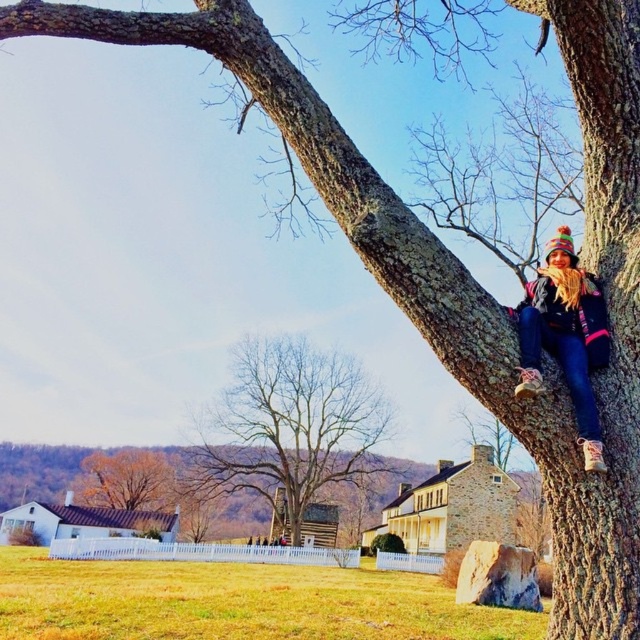
Is point (532, 300) farther from camera compared to point (81, 492)?

No, (532, 300) is closer to viewer.

In the scene shown: Which is more to the right, multicolored knitted hat at upper right or golden brown leaves at lower left?

Positioned to the right is multicolored knitted hat at upper right.

What do you see at coordinates (564, 337) in the screenshot?
I see `multicolored knitted hat at upper right` at bounding box center [564, 337].

The image size is (640, 640). Find the location of `multicolored knitted hat at upper right`. multicolored knitted hat at upper right is located at coordinates (564, 337).

Does brown rough tree at center appear on the left side of multicolored knitted hat at upper right?

Indeed, brown rough tree at center is positioned on the left side of multicolored knitted hat at upper right.

Between point (378, 408) and point (550, 308), which one is positioned in front?

Point (550, 308) is in front.

You are a GUI agent. You are given a task and a screenshot of the screen. Output one action in this format:
    pyautogui.click(x=<x>, y=<y>)
    Task: Click on the brown rough tree at center
    This screenshot has height=640, width=640.
    Given the screenshot: What is the action you would take?
    pyautogui.click(x=289, y=428)

Where is `brown rough tree at center`? brown rough tree at center is located at coordinates (289, 428).

Is point (540, 452) farther from viewer compared to point (296, 372)?

No.

Where is `smooth bark tree trunk at right`? The width and height of the screenshot is (640, 640). smooth bark tree trunk at right is located at coordinates (611, 321).

Is point (618, 636) closer to camera compared to point (230, 493)?

Yes.

At what (x,y) coordinates should I click in order to perform the action: click on smooth bark tree trunk at right. Please return your answer as a coordinate pair (x, y). Looking at the image, I should click on (611, 321).